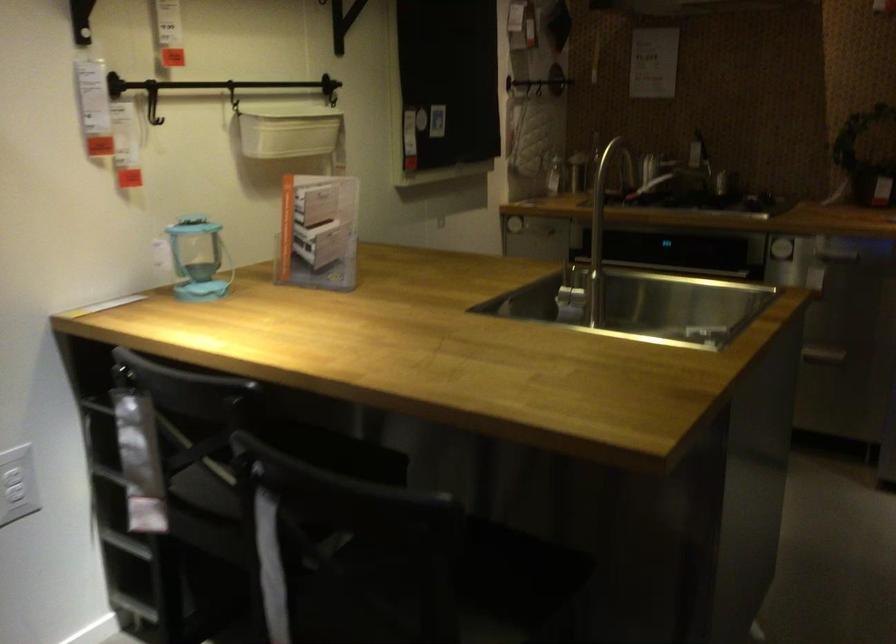
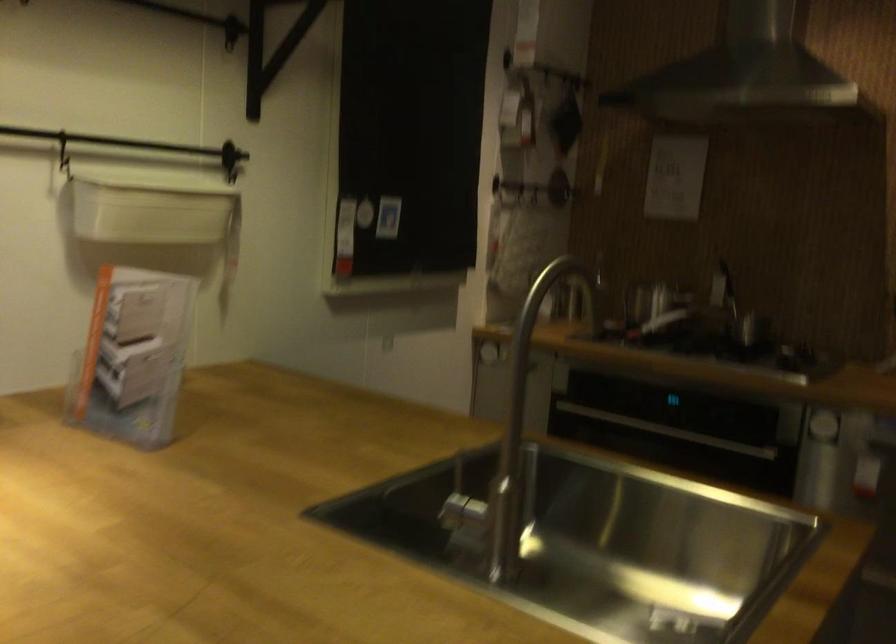
Question: The images are taken continuously from a first-person perspective. In which direction is your viewpoint rotating?

Choices:
 (A) Left
 (B) Right
 (C) Up
 (D) Down

Answer: (C)